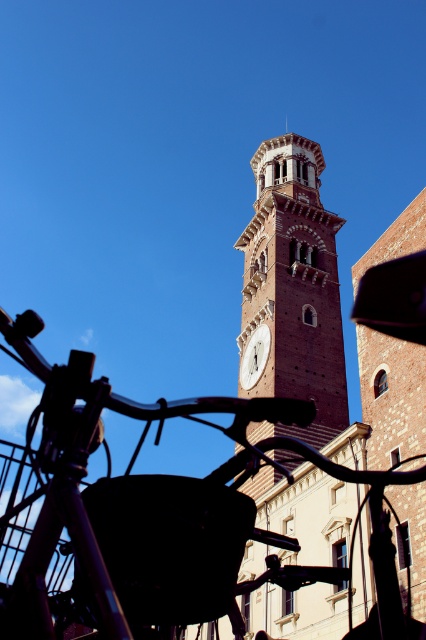
Question: Is black matte bicycle at lower left wider than brown brick clock tower at center?

Choices:
 (A) no
 (B) yes

Answer: (B)

Question: Can you confirm if black matte bicycle at lower left is thinner than white marble clock at center?

Choices:
 (A) no
 (B) yes

Answer: (A)

Question: Which object appears closest to the camera in this image?

Choices:
 (A) white marble clock at center
 (B) brown brick clock tower at center

Answer: (B)

Question: Among these points, which one is farthest from the camera?

Choices:
 (A) (249, 522)
 (B) (245, 364)
 (C) (324, 227)

Answer: (C)

Question: From the image, what is the correct spatial relationship of brown brick clock tower at center in relation to white marble clock at center?

Choices:
 (A) left
 (B) right

Answer: (B)

Question: Which of the following is the closest to the observer?

Choices:
 (A) white marble clock at center
 (B) brown brick clock tower at center

Answer: (B)